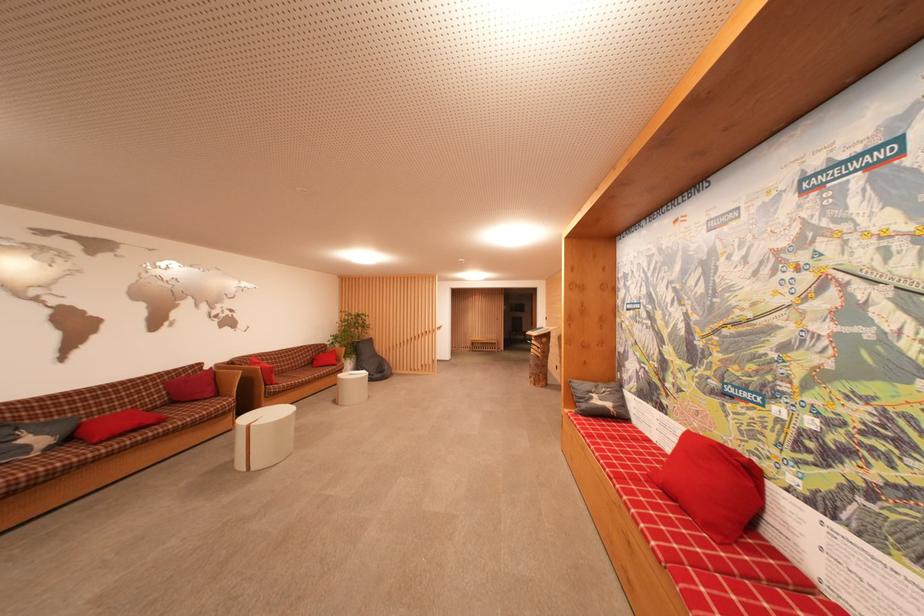
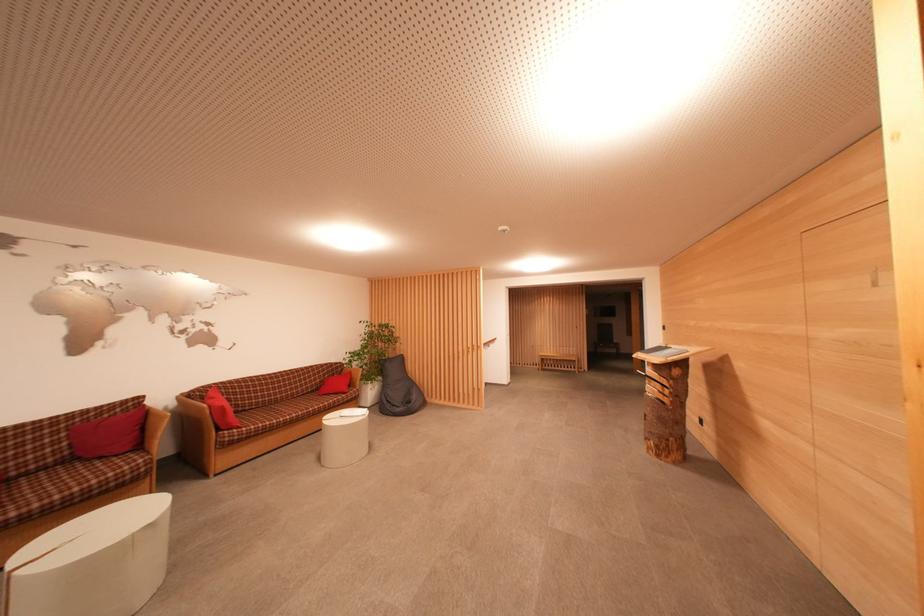
Locate, in the second image, the point that corresponds to point 272,375 in the first image.

(223, 416)